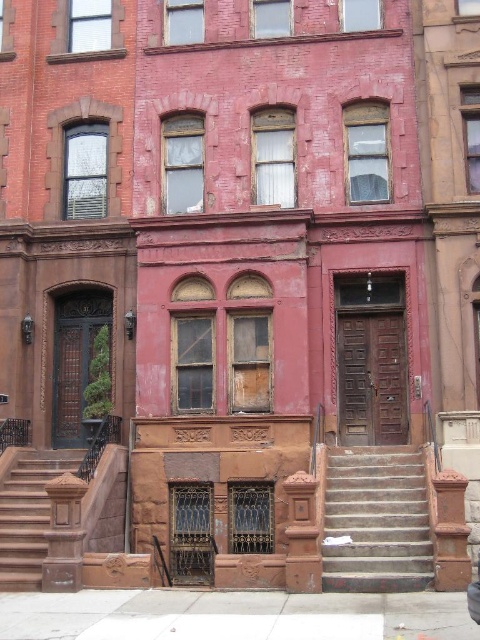
Question: Which point is closer to the camera?

Choices:
 (A) (354, 572)
 (B) (13, 476)

Answer: (A)

Question: From the image, what is the correct spatial relationship of concrete stairs at center in relation to brown stone stairs at lower left?

Choices:
 (A) below
 (B) above

Answer: (B)

Question: Observing the image, what is the correct spatial positioning of concrete stairs at center in reference to brown stone stairs at lower left?

Choices:
 (A) above
 (B) below

Answer: (A)

Question: Is concrete stairs at center above brown stone stairs at lower left?

Choices:
 (A) no
 (B) yes

Answer: (B)

Question: Which point is farther from the camera taking this photo?

Choices:
 (A) (332, 579)
 (B) (41, 547)

Answer: (B)

Question: Which point is closer to the camera?

Choices:
 (A) (0, 509)
 (B) (419, 476)

Answer: (A)